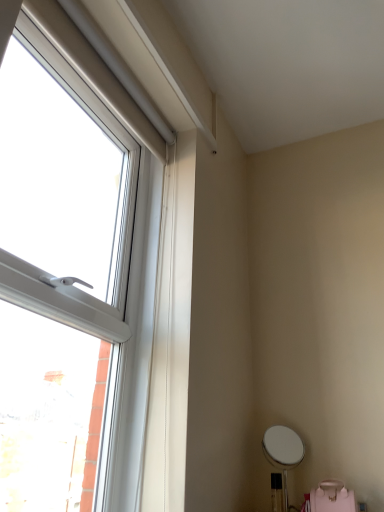
This screenshot has height=512, width=384. Identify the location of pink matte swivel chair at lower right. (330, 498).

The image size is (384, 512). What do you see at coordinates (330, 498) in the screenshot?
I see `pink matte swivel chair at lower right` at bounding box center [330, 498].

In order to face pink matte swivel chair at lower right, should I rotate leftwards or rightwards?

A 18.271 degree turn to the right will do.

What is the approximate width of pink matte swivel chair at lower right?

pink matte swivel chair at lower right is 12.99 centimeters wide.

Describe the element at coordinates (71, 285) in the screenshot. Image resolution: width=384 pixels, height=512 pixels. I see `transparent plastic window at left` at that location.

Identify the location of transparent plastic window at left. The width and height of the screenshot is (384, 512). (71, 285).

Measure the distance between transparent plastic window at left and camera.

1.02 meters.

What are the coordinates of `pink matte swivel chair at lower right` in the screenshot? It's located at pyautogui.click(x=330, y=498).

Based on the photo, does transparent plastic window at left appear on the left side of pink matte swivel chair at lower right?

Yes, transparent plastic window at left is to the left of pink matte swivel chair at lower right.

Is the position of transparent plastic window at left more distant than that of pink matte swivel chair at lower right?

No, the depth of transparent plastic window at left is less than that of pink matte swivel chair at lower right.

Which is closer to the camera, (107, 160) or (313, 502)?

Point (107, 160) appears to be farther away from the viewer than point (313, 502).

From the image's perspective, is transparent plastic window at left below pink matte swivel chair at lower right?

No, from the image's perspective, transparent plastic window at left is not beneath pink matte swivel chair at lower right.

From a real-world perspective, relative to pink matte swivel chair at lower right, is transparent plastic window at left vertically above or below?

transparent plastic window at left is above pink matte swivel chair at lower right.

Can you confirm if transparent plastic window at left is thinner than pink matte swivel chair at lower right?

Correct, the width of transparent plastic window at left is less than that of pink matte swivel chair at lower right.

Is transparent plastic window at left shorter than pink matte swivel chair at lower right?

No, transparent plastic window at left is not shorter than pink matte swivel chair at lower right.

Considering the relative sizes of transparent plastic window at left and pink matte swivel chair at lower right in the image provided, is transparent plastic window at left smaller than pink matte swivel chair at lower right?

Actually, transparent plastic window at left might be larger than pink matte swivel chair at lower right.

Is pink matte swivel chair at lower right a part of transparent plastic window at left?

No, pink matte swivel chair at lower right is not inside transparent plastic window at left.

Is transparent plastic window at left not near pink matte swivel chair at lower right?

Indeed, transparent plastic window at left is not near pink matte swivel chair at lower right.

Is transparent plastic window at left facing away from pink matte swivel chair at lower right?

That's not correct — transparent plastic window at left is not looking away from pink matte swivel chair at lower right.

Find the location of a particular element. This screenshot has height=512, width=384. swivel chair behind the transparent plastic window at left is located at coordinates (330, 498).

Which object is positioned more to the left, pink matte swivel chair at lower right or transparent plastic window at left?

From the viewer's perspective, transparent plastic window at left appears more on the left side.

Is pink matte swivel chair at lower right positioned in front of transparent plastic window at left?

No, pink matte swivel chair at lower right is further to the viewer.

Which point is more distant from viewer, (320, 510) or (57, 192)?

Point (320, 510)

From the image's perspective, would you say pink matte swivel chair at lower right is shown under transparent plastic window at left?

Correct, pink matte swivel chair at lower right appears lower than transparent plastic window at left in the image.

From a real-world perspective, is pink matte swivel chair at lower right under transparent plastic window at left?

Yes, from a real-world perspective, pink matte swivel chair at lower right is beneath transparent plastic window at left.

Can you confirm if pink matte swivel chair at lower right is thinner than transparent plastic window at left?

No.

Does pink matte swivel chair at lower right have a lesser height compared to transparent plastic window at left?

Correct, pink matte swivel chair at lower right is not as tall as transparent plastic window at left.

Is pink matte swivel chair at lower right smaller than transparent plastic window at left?

Yes, pink matte swivel chair at lower right is smaller than transparent plastic window at left.

Would you say pink matte swivel chair at lower right is inside or outside transparent plastic window at left?

pink matte swivel chair at lower right cannot be found inside transparent plastic window at left.

Is pink matte swivel chair at lower right directly adjacent to transparent plastic window at left?

pink matte swivel chair at lower right and transparent plastic window at left are not in contact.

Is pink matte swivel chair at lower right facing towards transparent plastic window at left?

No, pink matte swivel chair at lower right is not facing towards transparent plastic window at left.

In the scene shown: What's the angular difference between pink matte swivel chair at lower right and transparent plastic window at left's facing directions?

The angle between the facing direction of pink matte swivel chair at lower right and the facing direction of transparent plastic window at left is 87.8 degrees.

I want to click on swivel chair that is on the right side of transparent plastic window at left, so click(x=330, y=498).

Find the location of a particular element. Image resolution: width=384 pixels, height=512 pixels. swivel chair on the right of the transparent plastic window at left is located at coordinates (330, 498).

Identify the location of swivel chair below the transparent plastic window at left (from the image's perspective). (330, 498).